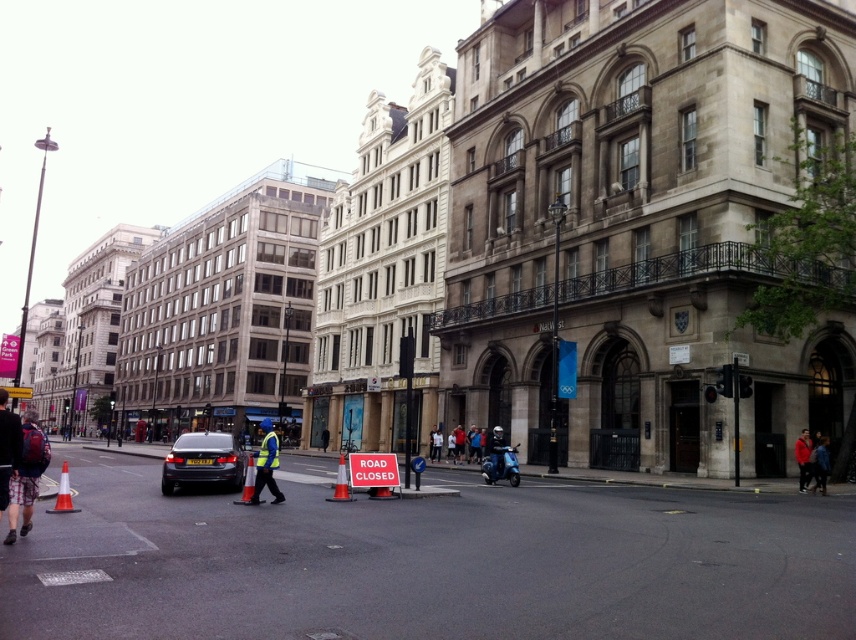
You are a pedestrian standing at the entrance of the street. You see a matte black car at center and a dark blue jacket at lower right. Which object is nearer to you?

The matte black car at center is closer to the viewer than the dark blue jacket at lower right, so the matte black car at center is nearer to you.

You are a pedestrian walking on the street and see the red jacket at lower right and the orange plastic cone at center. Which object is taller?

The orange plastic cone at center is taller than the red jacket at lower right.